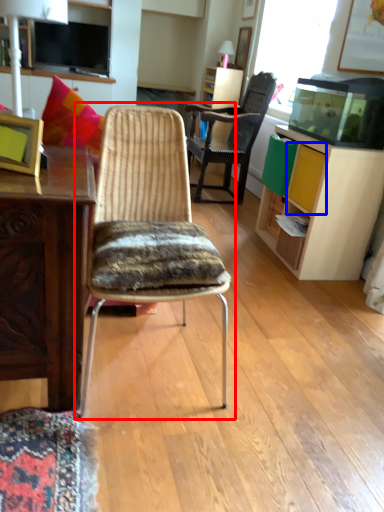
Question: Among these objects, which one is nearest to the camera, chair (highlighted by a red box) or drawer (highlighted by a blue box)?

Choices:
 (A) chair
 (B) drawer

Answer: (A)